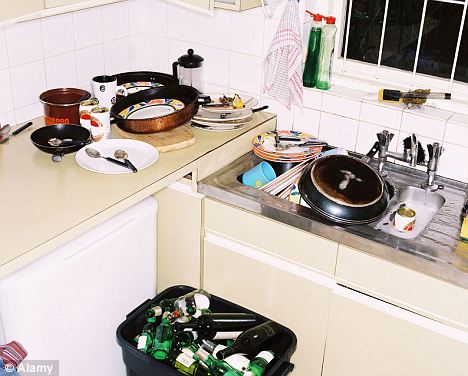
At what (x,y) coordinates should I click in order to perform the action: click on bottles. Please return your answer as a coordinate pair (x, y). Looking at the image, I should click on (166, 343).